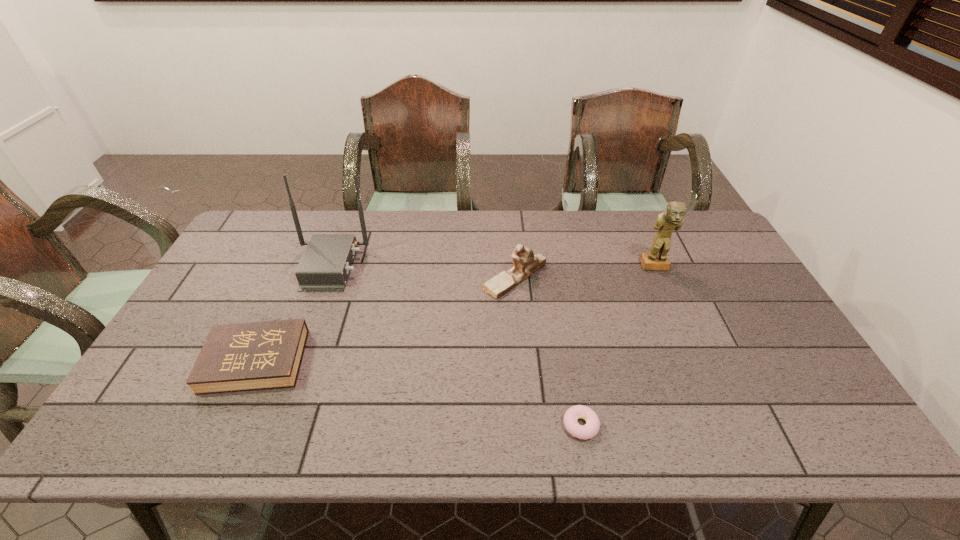
Where is `vacant space at the near edge`? vacant space at the near edge is located at coordinates (251, 415).

What are the coordinates of `vacant space at the right edge of the desktop` in the screenshot? It's located at coord(726,255).

Locate an element on the screen. Image resolution: width=960 pixels, height=540 pixels. vacant area at the far left corner is located at coordinates (286, 225).

Image resolution: width=960 pixels, height=540 pixels. In the image, there is a desktop. Identify the location of vacant space at the far right corner. (704, 236).

This screenshot has height=540, width=960. I want to click on free space between the fourth tallest object and the shortest object, so click(419, 393).

The height and width of the screenshot is (540, 960). In order to click on free area in between the rightmost object and the hardback book in this screenshot , I will do `click(455, 314)`.

Find the location of a particular element. The height and width of the screenshot is (540, 960). free spot between the fourth tallest object and the left figurine is located at coordinates (386, 319).

Find the location of a particular element. The height and width of the screenshot is (540, 960). vacant space that's between the left figurine and the taller figurine is located at coordinates (585, 272).

You are a GUI agent. You are given a task and a screenshot of the screen. Output one action in this format:
    pyautogui.click(x=<x>, y=<y>)
    Task: Click on the free spot between the left figurine and the rightmost object
    The image size is (960, 540).
    Given the screenshot: What is the action you would take?
    pyautogui.click(x=585, y=272)

The image size is (960, 540). In order to click on vacant area that lies between the router and the rightmost object in this screenshot , I will do `click(492, 266)`.